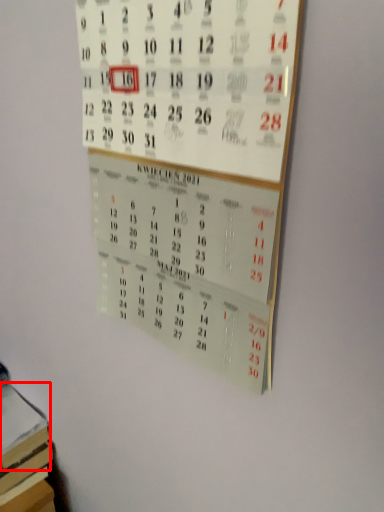
Question: From the image's perspective, considering the relative positions of book (annotated by the red box) and bulletin board in the image provided, where is book (annotated by the red box) located with respect to the staircase?

Choices:
 (A) below
 (B) above

Answer: (A)